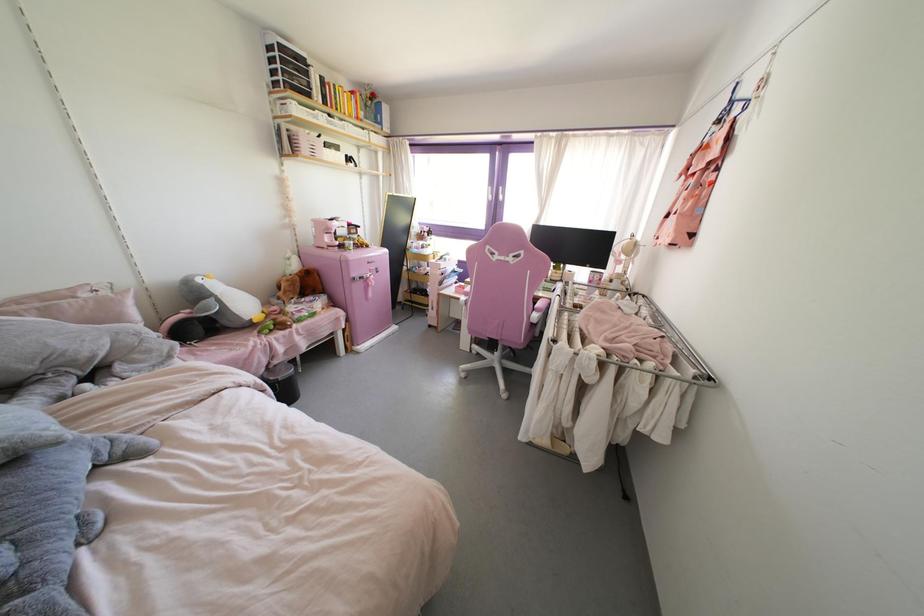
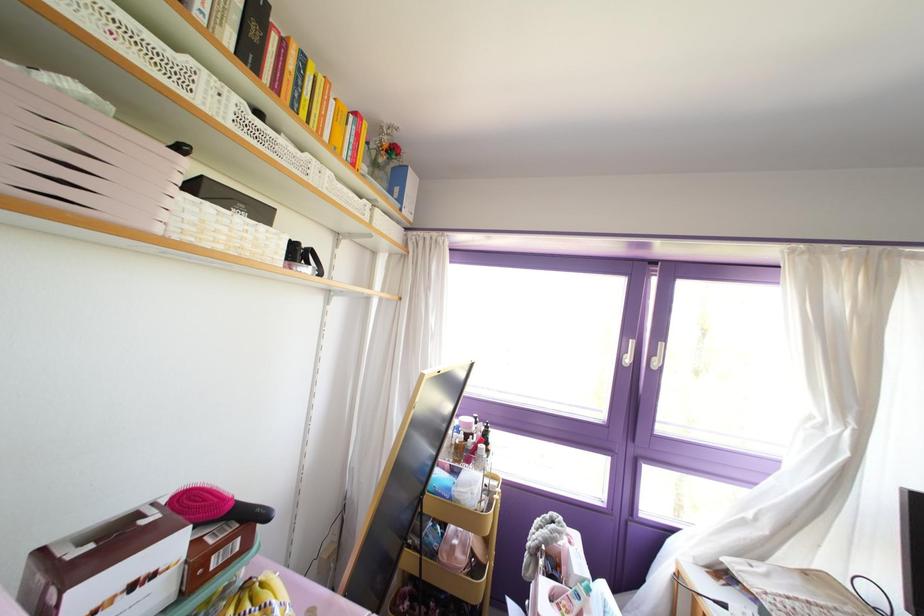
The point at (365, 105) is marked in the first image. Where is the corresponding point in the second image?

(372, 163)